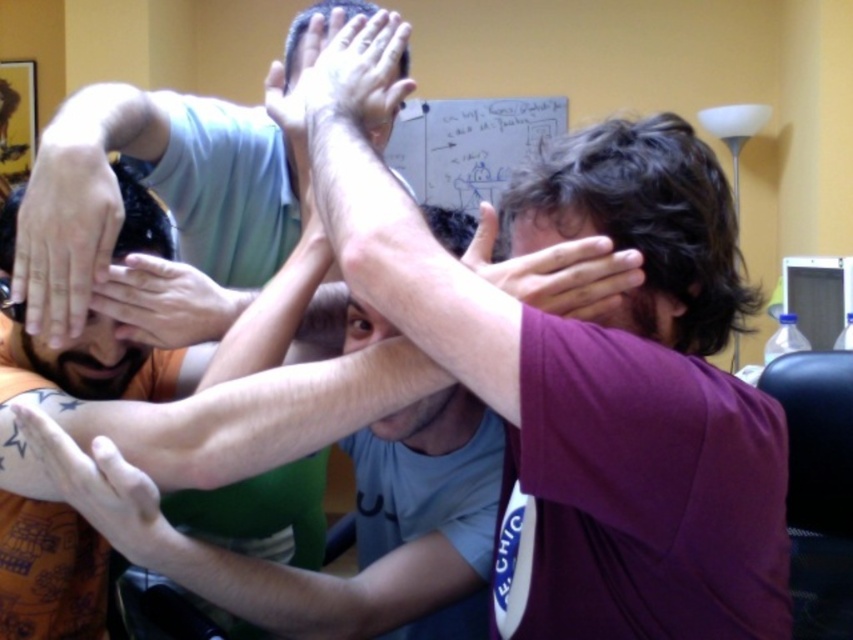
Is tattooed skin at center wider than matte skin hand at upper center?

Yes.

Looking at this image, measure the distance between tattooed skin at center and camera.

The distance of tattooed skin at center from camera is 80.51 centimeters.

Where is `tattooed skin at center`? The width and height of the screenshot is (853, 640). tattooed skin at center is located at coordinates (248, 557).

Looking at this image, who is more forward, (480, 237) or (553, 308)?

Point (553, 308)

Is purple matte hand at center further to camera compared to matte skin hand at center?

No, purple matte hand at center is in front of matte skin hand at center.

Does point (396, 422) come in front of point (564, 237)?

No, (396, 422) is behind (564, 237).

Where is `purple matte hand at center`? purple matte hand at center is located at coordinates (543, 266).

Based on the photo, which is more to the right, tattooed skin at center or matte skin hands at center?

Positioned to the right is tattooed skin at center.

Looking at this image, can you confirm if tattooed skin at center is positioned above matte skin hands at center?

No.

I want to click on tattooed skin at center, so click(248, 557).

Where is `tattooed skin at center`? Image resolution: width=853 pixels, height=640 pixels. tattooed skin at center is located at coordinates (248, 557).